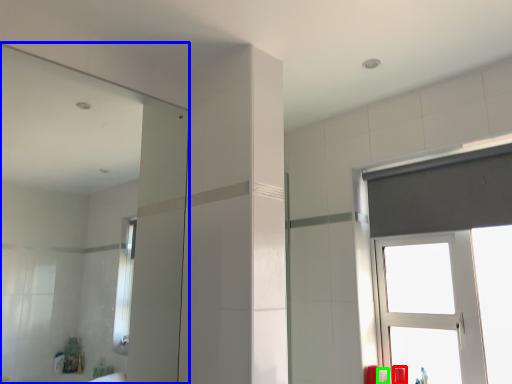
Question: Which object is the closest to the toiletry (highlighted by a red box)? Choose among these: mirror (highlighted by a blue box) or toiletry (highlighted by a green box).

Choices:
 (A) mirror
 (B) toiletry

Answer: (B)